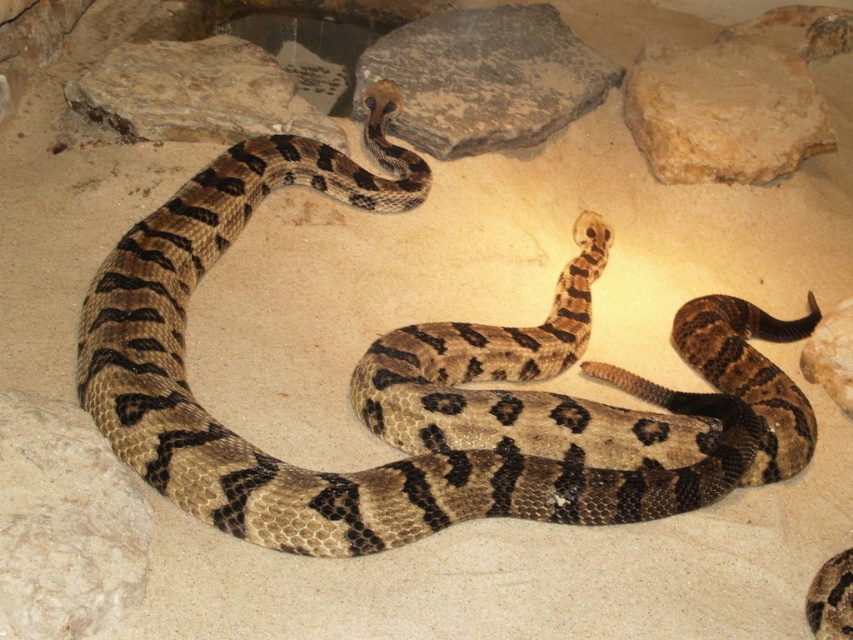
You are standing in front of a terrarium with a coiled snake and rocks. There is a point at coordinates point (65, 426). If you want to touch this point with a stick that is 1.5 meters long, can you reach it?

The point (65, 426) is 2.04 meters from the camera, so the stick is too short to reach it since it is only 1.5 meters long.

Consider the image. You are a herpetologist observing a snake in its enclosure. You notice two rocks in the enclosure, the smooth beige rock at upper right and the smooth rock at lower right. Which rock is taller?

The smooth beige rock at upper right is taller than the smooth rock at lower right.

You are a small lizard that can jump up to 1 meter. You want to jump from the smooth beige rock at upper right to the smooth rock at lower right. Can you make the jump?

The smooth beige rock at upper right is 1.11 meters away from smooth rock at lower right. Since the lizard can jump up to 1 meter, it cannot make the jump as the distance is slightly longer than its maximum jumping ability.